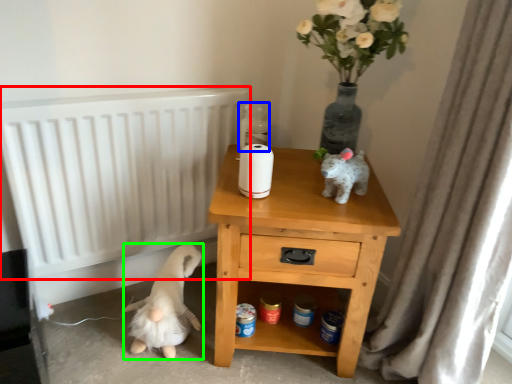
Question: Which object is positioned closest to radiator (highlighted by a red box)? Select from bottle (highlighted by a blue box) and animal (highlighted by a green box).

Choices:
 (A) bottle
 (B) animal

Answer: (B)